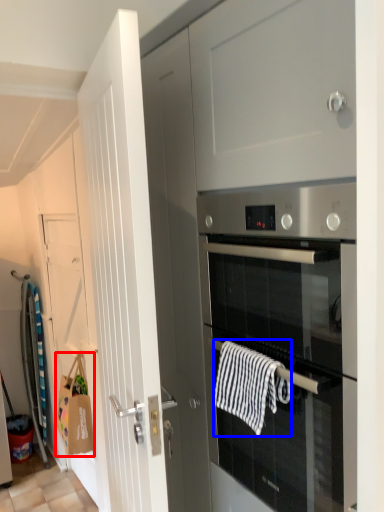
Question: Which object appears farthest to the camera in this image, hand towel (highlighted by a red box) or hand towel (highlighted by a blue box)?

Choices:
 (A) hand towel
 (B) hand towel

Answer: (A)